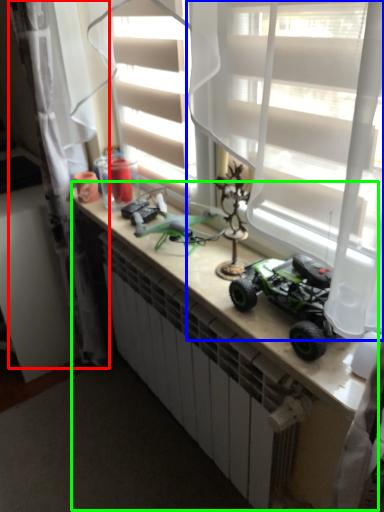
Question: Which object is the farthest from curtain (highlighted by a red box)? Choose among these: curtain (highlighted by a blue box) or counter (highlighted by a green box).

Choices:
 (A) curtain
 (B) counter

Answer: (A)